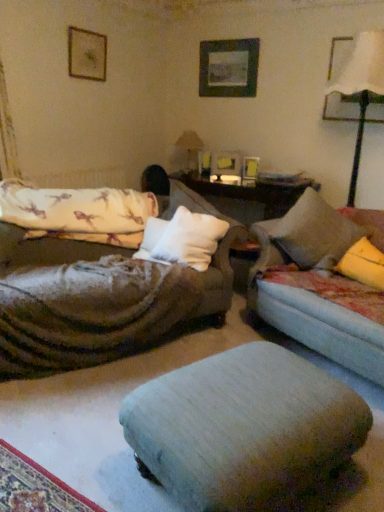
You are a GUI agent. You are given a task and a screenshot of the screen. Output one action in this format:
    pyautogui.click(x=<x>, y=<y>)
    Task: Click on the vacant space in front of wooden picture frame at center, marked as the 2th picture frame in a left-to-right arrangement
    The image size is (384, 512).
    Given the screenshot: What is the action you would take?
    click(235, 176)